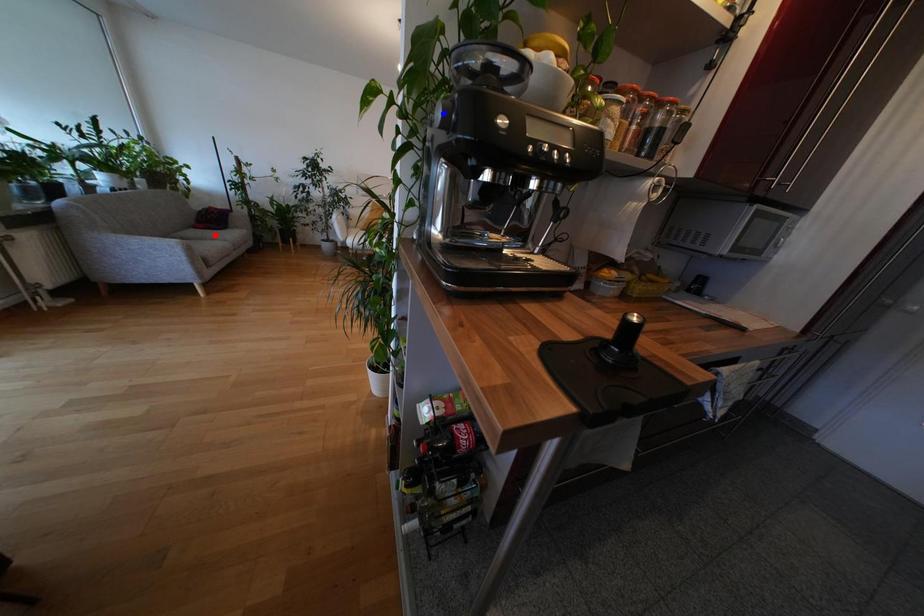
Question: Two points are marked on the image. Which point is closer to the camera?

Choices:
 (A) Blue point is closer.
 (B) Red point is closer.

Answer: (A)